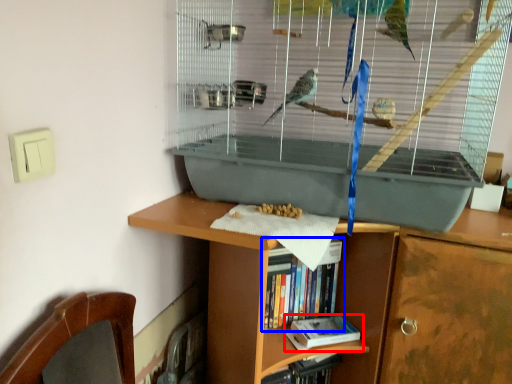
Question: Which object is closer to the camera taking this photo, book (highlighted by a red box) or book (highlighted by a blue box)?

Choices:
 (A) book
 (B) book

Answer: (B)